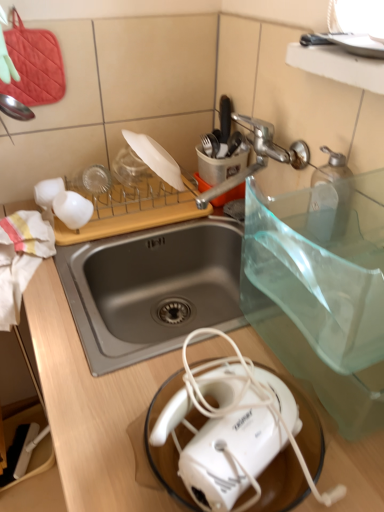
Question: Is white matte coffee cup at upper left to the right of white plastic toaster at lower center from the viewer's perspective?

Choices:
 (A) yes
 (B) no

Answer: (B)

Question: Is white matte coffee cup at upper left positioned before white plastic toaster at lower center?

Choices:
 (A) yes
 (B) no

Answer: (B)

Question: Considering the relative sizes of white matte coffee cup at upper left and white plastic toaster at lower center in the image provided, is white matte coffee cup at upper left thinner than white plastic toaster at lower center?

Choices:
 (A) yes
 (B) no

Answer: (A)

Question: Considering the relative positions of white matte coffee cup at upper left and white plastic toaster at lower center in the image provided, is white matte coffee cup at upper left to the left of white plastic toaster at lower center from the viewer's perspective?

Choices:
 (A) no
 (B) yes

Answer: (B)

Question: From a real-world perspective, is white matte coffee cup at upper left positioned over white plastic toaster at lower center based on gravity?

Choices:
 (A) no
 (B) yes

Answer: (A)

Question: From a real-world perspective, is silver metallic faucet at upper center above or below white wood cutting board at upper center?

Choices:
 (A) above
 (B) below

Answer: (A)

Question: Is silver metallic faucet at upper center taller or shorter than white wood cutting board at upper center?

Choices:
 (A) tall
 (B) short

Answer: (A)

Question: In the image, is silver metallic faucet at upper center positioned in front of or behind white wood cutting board at upper center?

Choices:
 (A) behind
 (B) front

Answer: (B)

Question: Is point click(x=213, y=198) closer or farther from the camera than point click(x=188, y=207)?

Choices:
 (A) farther
 (B) closer

Answer: (B)

Question: From a real-world perspective, is white plastic toaster at lower center positioned above or below white matte plate at upper center?

Choices:
 (A) below
 (B) above

Answer: (A)

Question: In terms of width, does white plastic toaster at lower center look wider or thinner when compared to white matte plate at upper center?

Choices:
 (A) wide
 (B) thin

Answer: (A)

Question: Based on their positions, is white plastic toaster at lower center located to the left or right of white matte plate at upper center?

Choices:
 (A) right
 (B) left

Answer: (A)

Question: From the image's perspective, is white plastic toaster at lower center located above or below white matte plate at upper center?

Choices:
 (A) above
 (B) below

Answer: (B)

Question: Is silver metallic faucet at upper center wider or thinner than white plastic toaster at lower center?

Choices:
 (A) thin
 (B) wide

Answer: (B)

Question: Is point (235, 184) closer or farther from the camera than point (203, 503)?

Choices:
 (A) closer
 (B) farther

Answer: (B)